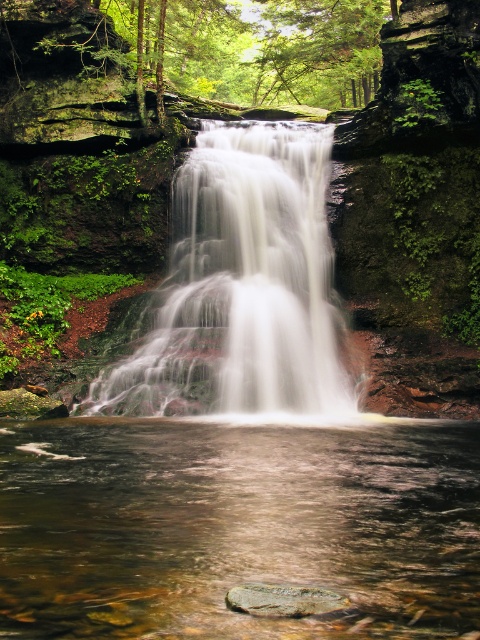
You are standing at the edge of the pool and want to cross to the other side. The path leads you past the white smooth waterfall at center and the translucent water at center. Which one should you avoid stepping on to stay safe?

You should avoid stepping on the white smooth waterfall at center because it is flowing water, while the translucent water at center is still and safer to walk on.

You are a hiker who wants to cross the pool at the bottom of the waterfall. You have a 6.5 feet long wooden plank. You see the translucent water at center and the smooth brown rock at center. Can you place the plank between them to cross?

The distance between the translucent water at center and the smooth brown rock at center is 7.00 feet. Since the plank is only 6.5 feet long, it is shorter than the required distance. Therefore, the plank cannot be placed between them to cross safely.